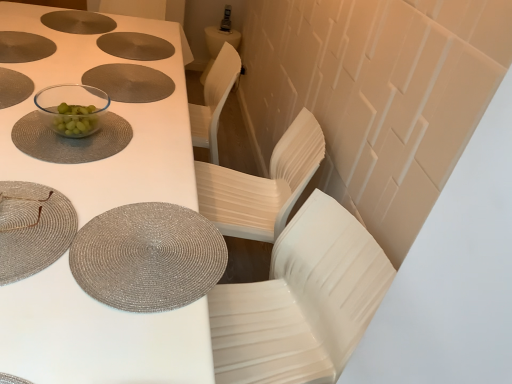
At what (x,y) coordinates should I click in order to perform the action: click on empty space that is ontop of silver woven placemat at lower left, which is the first tableware in front-to-back order. Please return your answer as a coordinate pair (x, y). Looking at the image, I should click on (28, 218).